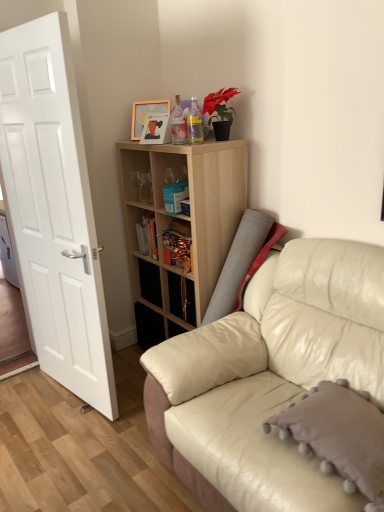
Identify the location of free space that is to the left of white matte door at left. (33, 399).